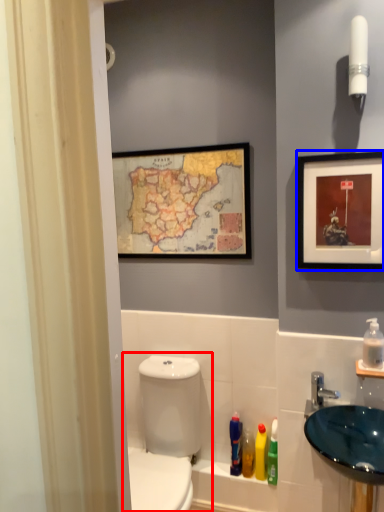
Question: Which object appears closest to the camera in this image, toilet (highlighted by a red box) or picture frame (highlighted by a blue box)?

Choices:
 (A) toilet
 (B) picture frame

Answer: (A)